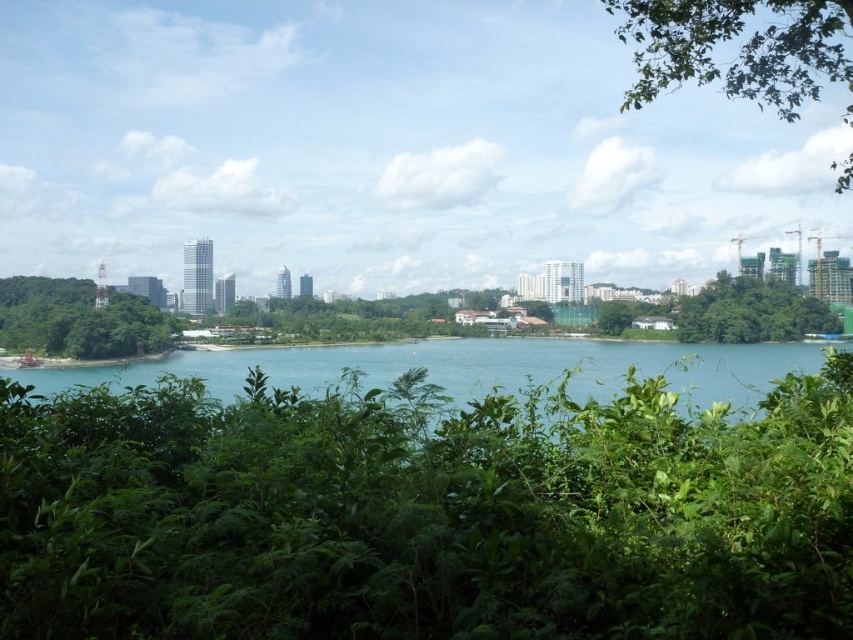
Who is more forward, (434,499) or (790,77)?

Point (434,499)

Image resolution: width=853 pixels, height=640 pixels. What are the coordinates of `green leafy vegetation at center` in the screenshot? It's located at (424, 513).

Which is behind, point (752, 10) or point (776, 298)?

Point (776, 298)

Where is `green leafy tree at upper right`? The width and height of the screenshot is (853, 640). green leafy tree at upper right is located at coordinates (737, 49).

Locate an element on the screen. The image size is (853, 640). green leafy tree at upper right is located at coordinates [737, 49].

I want to click on green leafy tree at upper right, so pos(737,49).

Is point (0, 508) farther from viewer compared to point (80, 339)?

No, (0, 508) is in front of (80, 339).

Describe the element at coordinates (424, 513) in the screenshot. I see `green leafy vegetation at center` at that location.

Find the location of a particular element. The image size is (853, 640). green leafy vegetation at center is located at coordinates (424, 513).